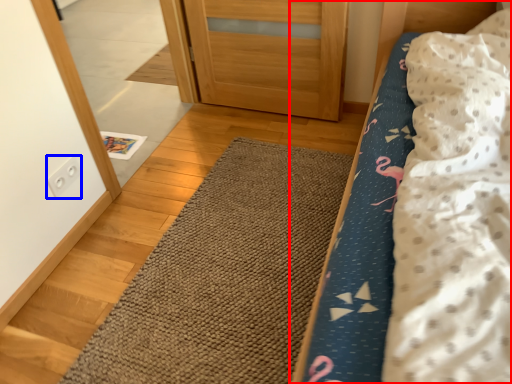
Question: Which object is closer to the camera taking this photo, bed (highlighted by a red box) or electric outlet (highlighted by a blue box)?

Choices:
 (A) bed
 (B) electric outlet

Answer: (A)